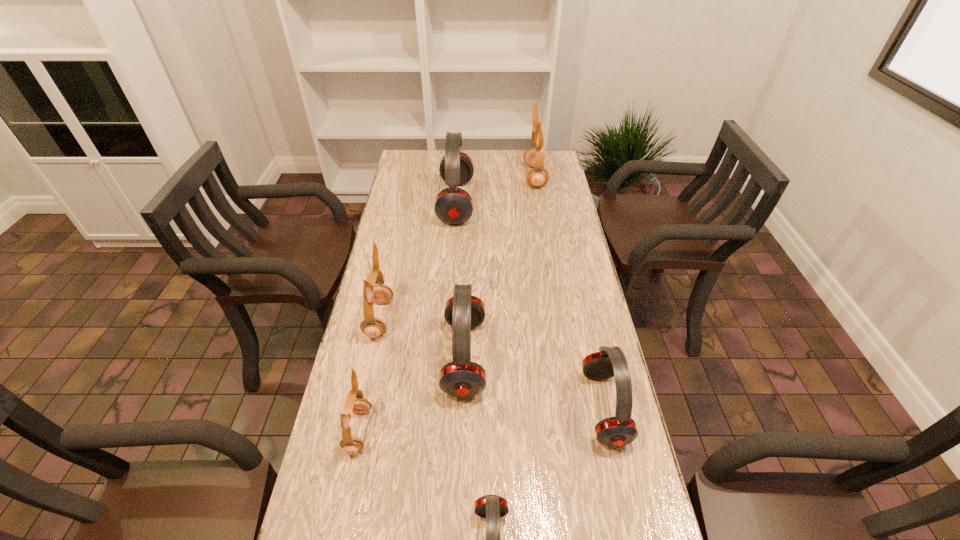
Find the location of a particular element. This screenshot has height=540, width=960. the farthest brown earphone is located at coordinates (537, 177).

This screenshot has height=540, width=960. Find the location of `the rightmost brown earphone`. the rightmost brown earphone is located at coordinates (537, 177).

The image size is (960, 540). I want to click on the farthest red earphone, so click(x=453, y=205).

Find the location of a particular element. The image size is (960, 540). the third smallest red earphone is located at coordinates (461, 378).

Where is `the second nearest brown earphone`? the second nearest brown earphone is located at coordinates (373, 327).

Where is `the second smallest red earphone`? The width and height of the screenshot is (960, 540). the second smallest red earphone is located at coordinates (620, 430).

At what (x,y) coordinates should I click in order to perform the action: click on the smallest brown earphone. Please return your answer as a coordinate pair (x, y). This screenshot has height=540, width=960. Looking at the image, I should click on (351, 444).

Locate an element on the screen. vacant area located 0.080m on the front-facing side of the rightmost brown earphone is located at coordinates (506, 177).

You are a GUI agent. You are given a task and a screenshot of the screen. Output one action in this format:
    pyautogui.click(x=<x>, y=<y>)
    Task: Click on the vacant area located 0.060m on the front-facing side of the rightmost brown earphone
    This screenshot has width=960, height=540.
    Given the screenshot: What is the action you would take?
    pyautogui.click(x=511, y=177)

Where is `free space located 0.330m on the front-facing side of the rightmost brown earphone`? The width and height of the screenshot is (960, 540). free space located 0.330m on the front-facing side of the rightmost brown earphone is located at coordinates (448, 177).